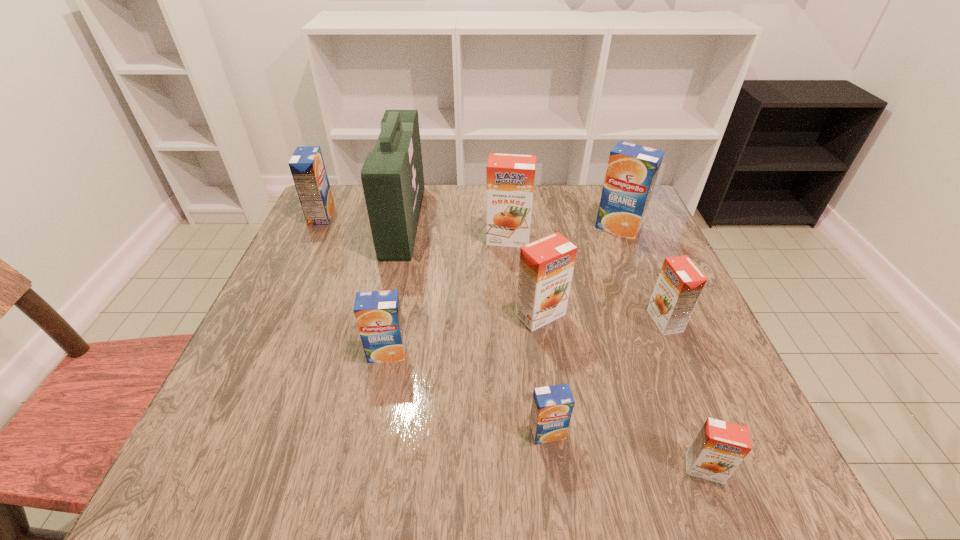
You are a GUI agent. You are given a task and a screenshot of the screen. Output one action in this format:
    pyautogui.click(x=<x>, y=<y>)
    Task: Click on the tallest object
    The width and height of the screenshot is (960, 540).
    Given the screenshot: What is the action you would take?
    pyautogui.click(x=392, y=177)

At what (x,y) coordinates should I click in order to perform the action: click on the farthest orange orange juice. Please return your answer as a coordinate pair (x, y). This screenshot has width=960, height=540. Looking at the image, I should click on (510, 178).

This screenshot has width=960, height=540. In order to click on the biggest blue orange_juice in this screenshot , I will do `click(632, 170)`.

You are a GUI agent. You are given a task and a screenshot of the screen. Output one action in this format:
    pyautogui.click(x=<x>, y=<y>)
    Task: Click on the leftmost object
    
    Given the screenshot: What is the action you would take?
    pyautogui.click(x=307, y=167)

Where is `the leftmost orange juice`? the leftmost orange juice is located at coordinates (307, 167).

Find the location of a particular element. The height and width of the screenshot is (540, 960). the third smallest orange orange juice is located at coordinates click(546, 266).

Locate an element on the screen. the second orange juice from left to right is located at coordinates (378, 315).

This screenshot has width=960, height=540. I want to click on the third farthest blue orange_juice, so click(378, 315).

Locate an element on the screen. This screenshot has width=960, height=540. the third biggest orange orange juice is located at coordinates (680, 283).

In order to click on the nearest blue orange_juice in this screenshot , I will do `click(552, 406)`.